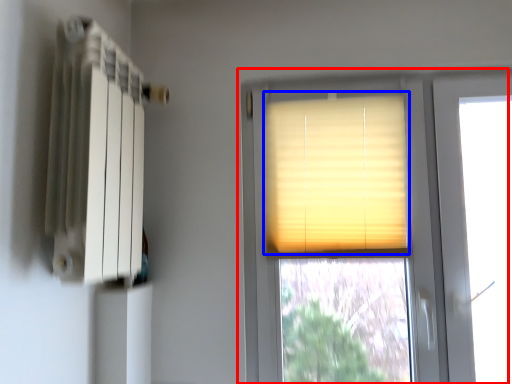
Question: Which point is further to the camera, window (highlighted by a red box) or window blind (highlighted by a blue box)?

Choices:
 (A) window
 (B) window blind

Answer: (B)